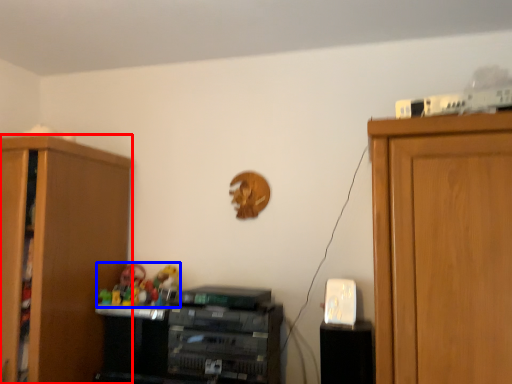
Question: Which point is closer to the camera, cabinetry (highlighted by a red box) or toy (highlighted by a blue box)?

Choices:
 (A) cabinetry
 (B) toy

Answer: (A)